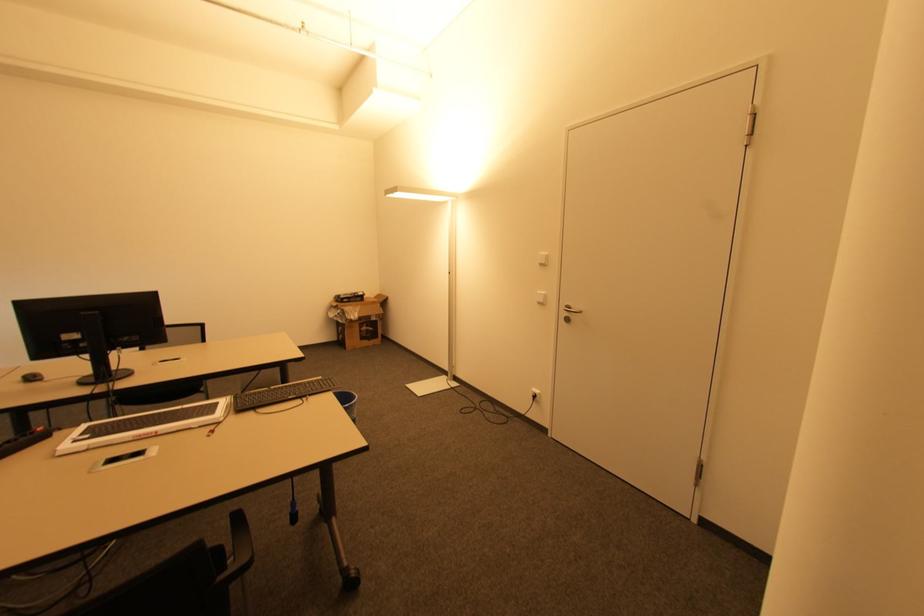
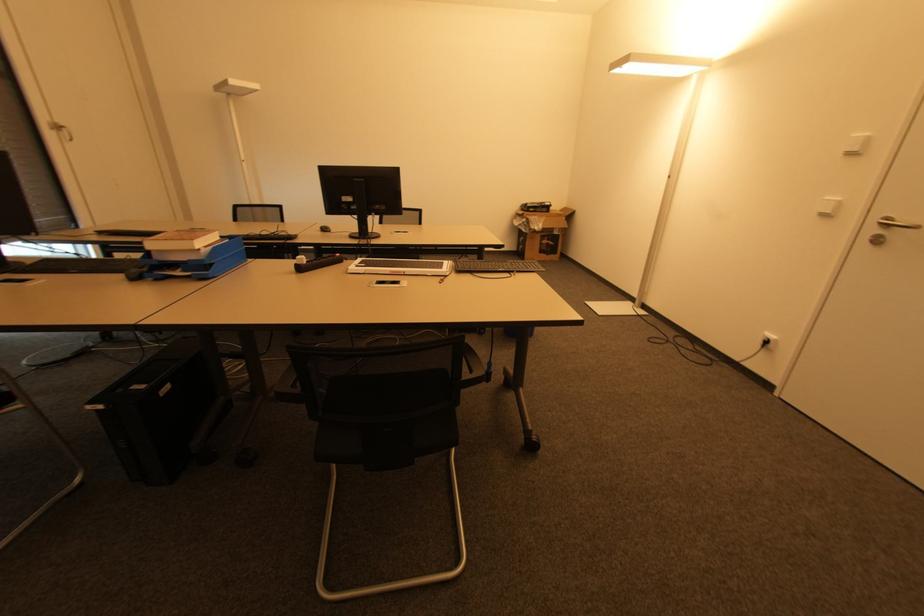
Where in the second image is the point corresponding to pixel 78 440 from the first image?

(359, 267)